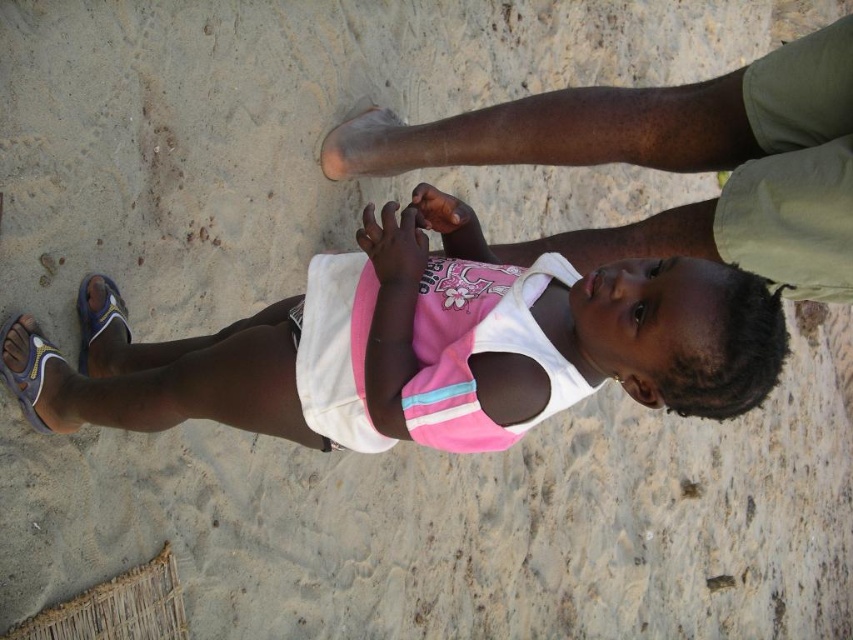
You are a photographer trying to capture a closeup of the pink fabric shirt at center and the green cotton shorts at upper right. Since you want both subjects to be in focus, which one should you focus on first to ensure proper depth of field?

The pink fabric shirt at center is smaller than the green cotton shorts at upper right, so you should focus on the pink fabric shirt at center first to ensure both are in focus.

You are a photographer trying to capture a photo of the pink fabric shirt at center and the blue fabric sandal at lower left. Which object should you focus on first if you want to ensure both are in the frame without moving the camera?

The pink fabric shirt at center should be focused on first because it has a greater height compared to the blue fabric sandal at lower left, so adjusting the camera angle to include the taller object will likely also capture the shorter one.